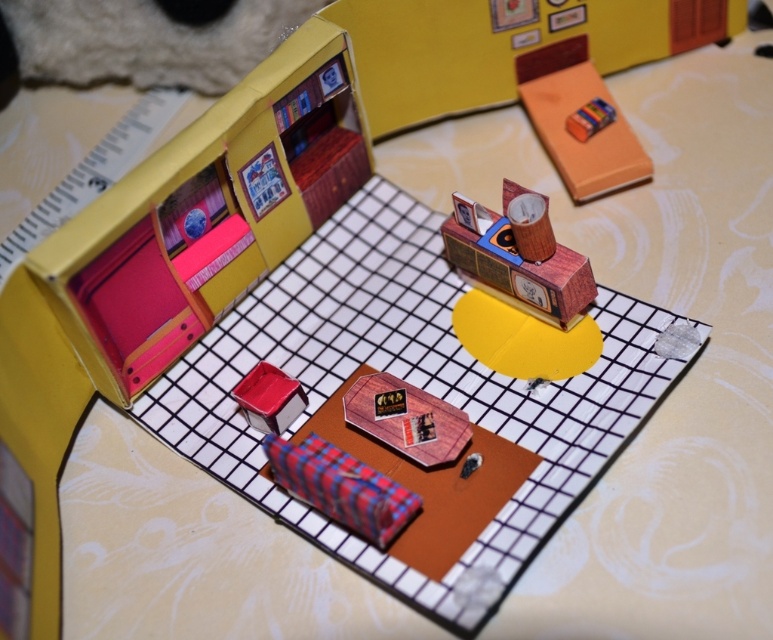
Who is more distant from viewer, (445, 420) or (570, 129)?

The point (570, 129) is behind.

The image size is (773, 640). Describe the element at coordinates (407, 419) in the screenshot. I see `wooden book at center` at that location.

Where is `wooden book at center`? This screenshot has height=640, width=773. wooden book at center is located at coordinates (407, 419).

Where is `plaid fabric couch at lower left`? Image resolution: width=773 pixels, height=640 pixels. plaid fabric couch at lower left is located at coordinates (162, 266).

Is plaid fabric couch at lower left taller than wooden clock at upper center?

Yes, plaid fabric couch at lower left is taller than wooden clock at upper center.

Does point (77, 268) come in front of point (455, 259)?

Yes, point (77, 268) is closer to viewer.

Where is `plaid fabric couch at lower left`? This screenshot has height=640, width=773. plaid fabric couch at lower left is located at coordinates (162, 266).

Where is `orange matte book at upper right`? The image size is (773, 640). orange matte book at upper right is located at coordinates (577, 120).

Who is more forward, (x=635, y=163) or (x=431, y=436)?

Point (x=431, y=436)

Where is `orange matte book at upper right`? This screenshot has height=640, width=773. orange matte book at upper right is located at coordinates (577, 120).